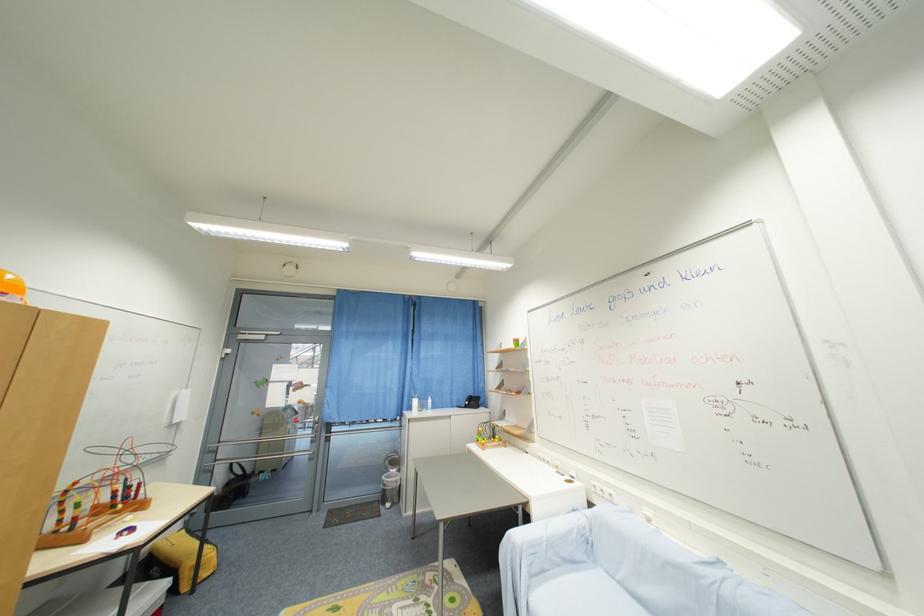
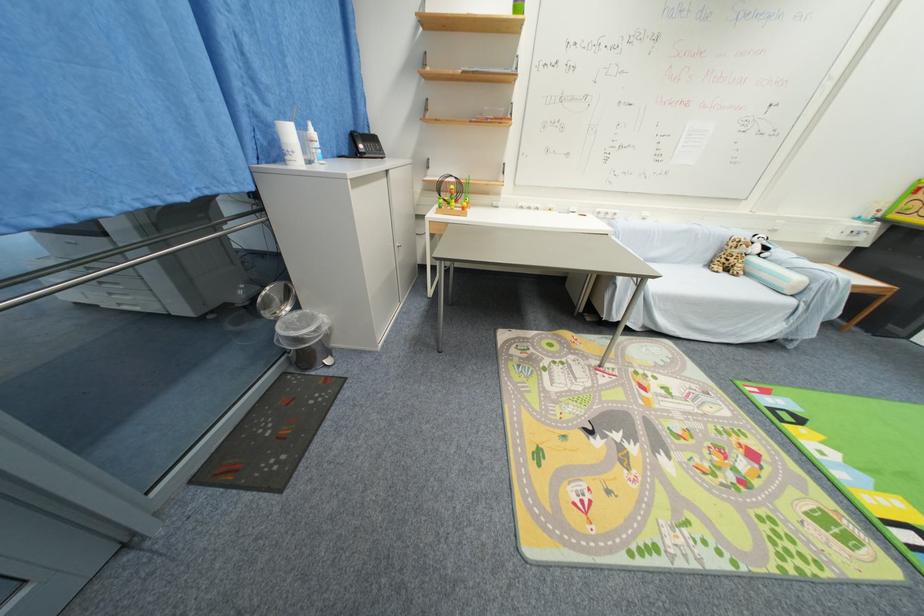
Find the pixel in the second image that matches pixel 478 405 in the first image.

(377, 148)